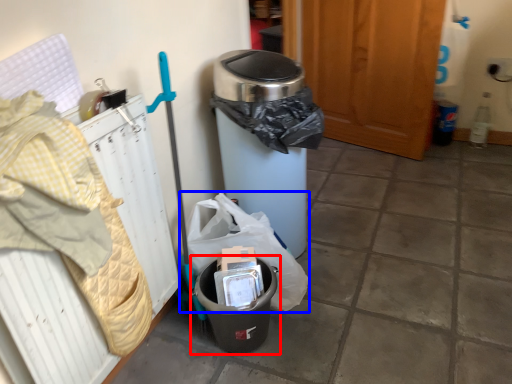
Question: Which object appears closest to the camera in this image, waste container (highlighted by a red box) or garbage (highlighted by a blue box)?

Choices:
 (A) waste container
 (B) garbage

Answer: (A)